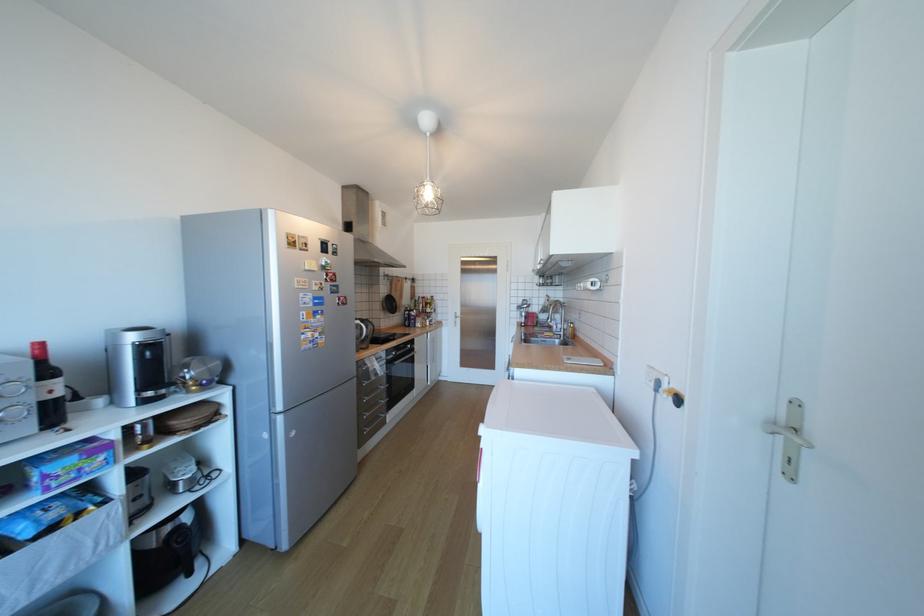
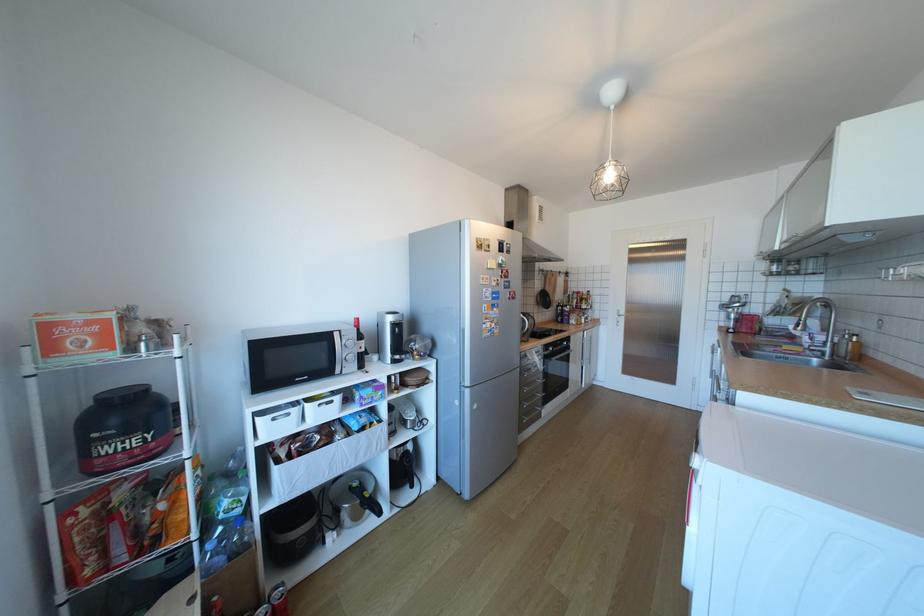
Where in the second image is the point corresponding to point (383, 378) from the first image?

(543, 371)